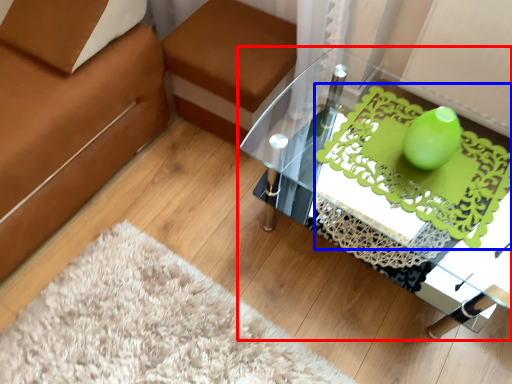
Question: Which object is further to the camera taking this photo, table (highlighted by a red box) or design (highlighted by a blue box)?

Choices:
 (A) table
 (B) design

Answer: (B)